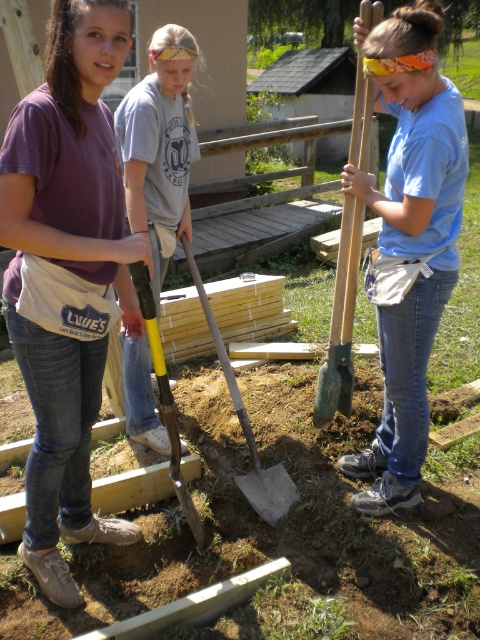
You are standing at the origin point in the scene. Which direction should you move to reach the matte purple shirt at upper left?

The matte purple shirt at upper left is located at point 0.422 on the x and 0.142 on the y coordinate. Since you are at the origin, you should move towards the upper left direction to reach it.

You are standing in front of the construction site and want to know which of the two points, point (99,278) or point (144,300), is closer to you. Can you determine this based on their positions?

Point (99,278) is closer to the camera than point (144,300), so it is closer to you.

From the picture: You are standing 3 meters away from the green wood shovel at center. Can you reach it without moving closer?

The green wood shovel at center is 2.82 meters away from the camera, so you are 0.18 meters farther than the shovel. Therefore, you can reach it without moving closer.